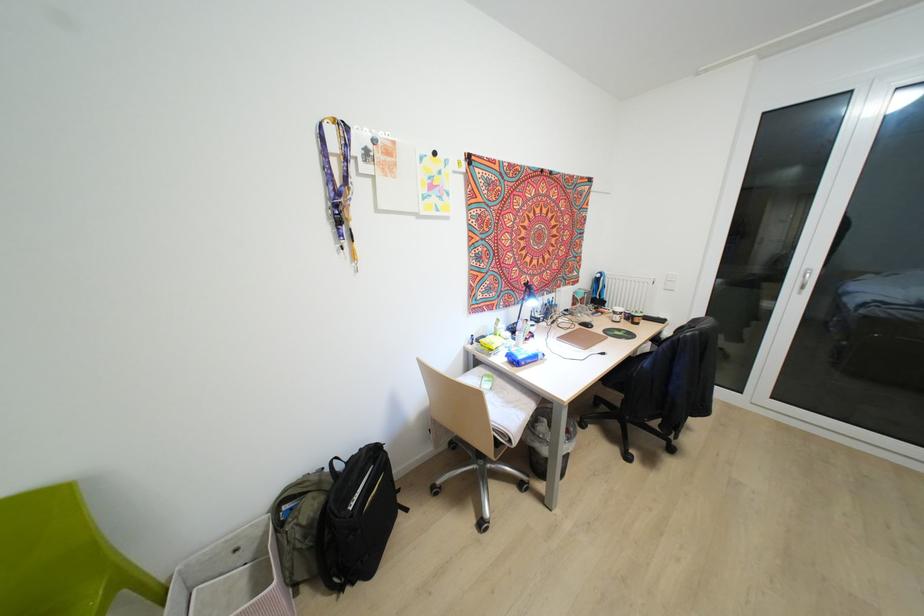
Image resolution: width=924 pixels, height=616 pixels. What do you see at coordinates (504, 403) in the screenshot? I see `the chair sitting surface` at bounding box center [504, 403].